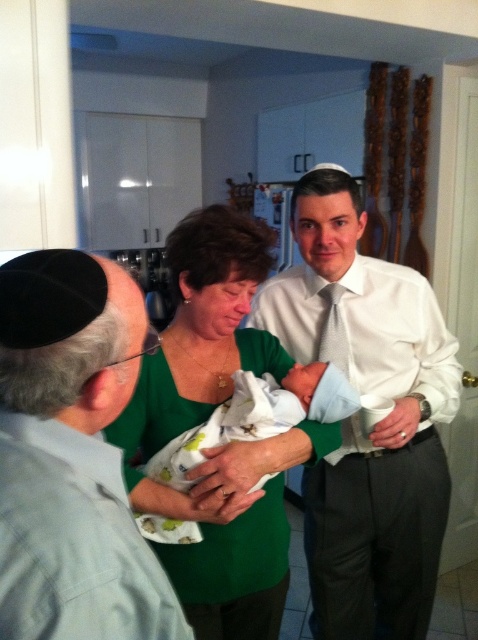
Based on the photo, is white cotton baby at center above white swaddled newborn at center?

No, white cotton baby at center is not above white swaddled newborn at center.

Find the location of `white cotton baby at center`. white cotton baby at center is located at coordinates (358, 417).

From the picture: Is white cotton baby at center thinner than green fabric shirt at center?

Incorrect, white cotton baby at center's width is not less than green fabric shirt at center's.

Is white cotton baby at center above green fabric shirt at center?

Actually, white cotton baby at center is below green fabric shirt at center.

Between point (310, 176) and point (226, 209), which one is positioned behind?

The point (310, 176) is behind.

This screenshot has width=478, height=640. I want to click on white cotton baby at center, so click(x=358, y=417).

Is the position of white cotton baby at center less distant than that of black fabric kippah at upper left?

No, white cotton baby at center is behind black fabric kippah at upper left.

Who is more distant from viewer, (384,314) or (55,355)?

Point (384,314)

Where is `white cotton baby at center`? The image size is (478, 640). white cotton baby at center is located at coordinates (358, 417).